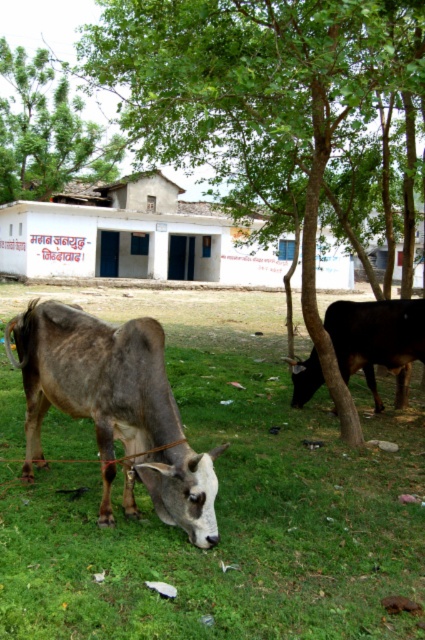
You are a farmer standing in front of the green leafy tree at center and the shiny brown bull at right. Which one is closer to you?

The green leafy tree at center is closer to you because it is in front of the shiny brown bull at right.

You are a farmer checking the size of your animals compared to the trees in your field. Which one is bigger between the gray matte cow at lower left and the green leafy tree at upper left?

The gray matte cow at lower left is smaller than the green leafy tree at upper left, so the tree is bigger.

You are a farmer trying to estimate the space needed to build a fence around your property. You notice the gray matte cow at lower left and the green leafy tree at upper left. Which object takes up more horizontal space in the image?

The green leafy tree at upper left takes up more horizontal space than the gray matte cow at lower left because the gray matte cow at lower left has a lesser width compared to the green leafy tree at upper left.